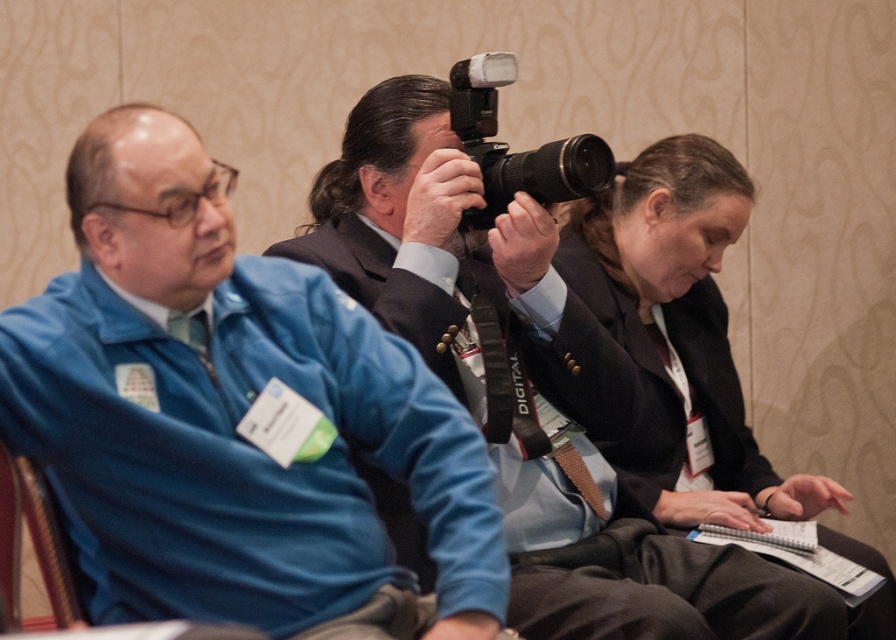
You are standing in the conference room and want to take a photo of the blue fleece jacket at left and the black matte camera at center. Which object should you position closer to the left side of your camera frame?

The blue fleece jacket at left should be positioned closer to the left side of your camera frame since it is already located to the left of the black matte camera at center.

You are organizing a photo shoot and need to ensure that the matte black blazer at center and the black plastic camera at center can both fit on a 1.2 meter wide table. Can they fit side by side?

The matte black blazer at center has a larger size compared to black plastic camera at center. If the combined width of both items is less than or equal to 1.2 meters, they can fit side by side. However, without specific measurements, it is impossible to determine definitively.

You are standing in the conference room and want to take a photo of the matte black blazer at center without the black plastic camera at center appearing in the shot. Is this possible given their relative heights?

The matte black blazer at center is taller than the black plastic camera at center, so if you position yourself lower or adjust your angle to focus on the upper part of the blazer, you can avoid the camera appearing in the shot.